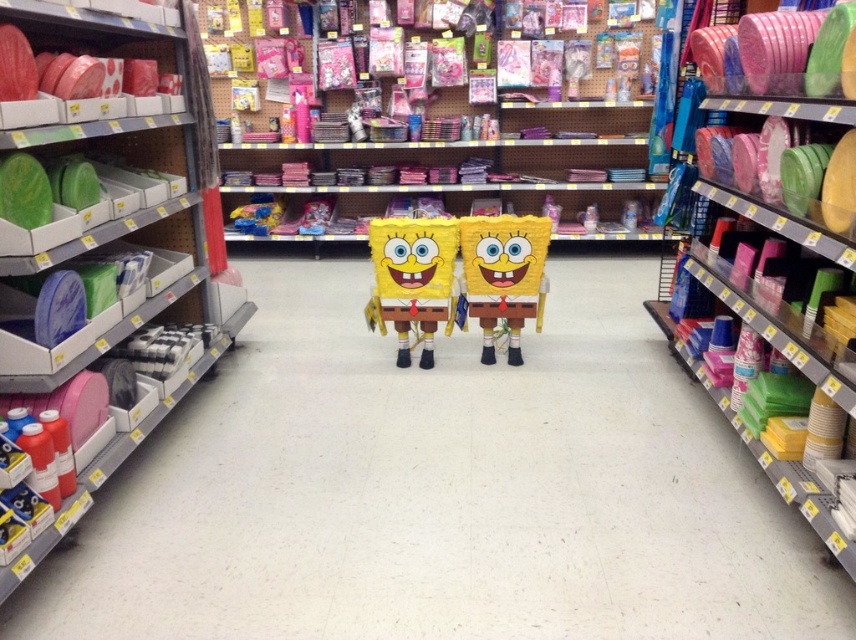
Which is above, matte yellow sponge at center or matte plastic plates at right?

matte yellow sponge at center

Looking at this image, which of these two, matte yellow sponge at center or matte plastic plates at right, stands taller?

matte yellow sponge at center is taller.

Identify the location of matte yellow sponge at center. The image size is (856, 640). (474, 154).

You are a GUI agent. You are given a task and a screenshot of the screen. Output one action in this format:
    pyautogui.click(x=<x>, y=<y>)
    Task: Click on the matte yellow sponge at center
    Image resolution: width=856 pixels, height=640 pixels.
    Given the screenshot: What is the action you would take?
    pyautogui.click(x=474, y=154)

Which is below, green matte plates at left or yellow matte pinata at center?

yellow matte pinata at center is lower down.

Does green matte plates at left have a larger size compared to yellow matte pinata at center?

Indeed, green matte plates at left has a larger size compared to yellow matte pinata at center.

The width and height of the screenshot is (856, 640). I want to click on green matte plates at left, so click(x=107, y=253).

Between point (179, 61) and point (425, 220), which one is positioned behind?

Point (425, 220)

Does point (153, 115) come farther from viewer compared to point (397, 298)?

No, (153, 115) is in front of (397, 298).

Image resolution: width=856 pixels, height=640 pixels. Identify the location of green matte plates at left. (107, 253).